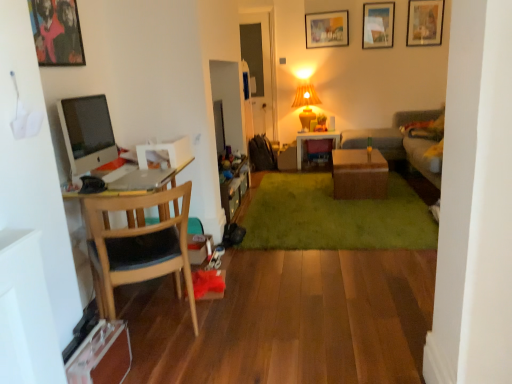
Image resolution: width=512 pixels, height=384 pixels. What do you see at coordinates (57, 32) in the screenshot? I see `metallic framed artwork at upper left, which is the fourth picture frame in right-to-left order` at bounding box center [57, 32].

Image resolution: width=512 pixels, height=384 pixels. What do you see at coordinates (334, 216) in the screenshot?
I see `green plush rug at center` at bounding box center [334, 216].

The width and height of the screenshot is (512, 384). What do you see at coordinates (359, 174) in the screenshot? I see `brown wicker table at center, which appears as the second table when viewed from the back` at bounding box center [359, 174].

How much space does wooden picture frame at upper center, positioned as the 3th picture frame in right-to-left order, occupy horizontally?

wooden picture frame at upper center, positioned as the 3th picture frame in right-to-left order, is 1.44 inches in width.

What do you see at coordinates (327, 29) in the screenshot? I see `wooden picture frame at upper center, arranged as the 1th picture frame when viewed from the back` at bounding box center [327, 29].

Find the location of a particular element. The height and width of the screenshot is (384, 512). wooden chair at left is located at coordinates (x=139, y=245).

Considering the relative positions of green plush rug at center and matte glass picture frame at upper right, the third picture frame ordered from the bottom, in the image provided, is green plush rug at center to the right of matte glass picture frame at upper right, the third picture frame ordered from the bottom, from the viewer's perspective?

Incorrect, green plush rug at center is not on the right side of matte glass picture frame at upper right, the third picture frame ordered from the bottom.

Does green plush rug at center lie behind matte glass picture frame at upper right, which is counted as the second picture frame, starting from the back?

No, it is in front of matte glass picture frame at upper right, which is counted as the second picture frame, starting from the back.

From a real-world perspective, between green plush rug at center and matte glass picture frame at upper right, which is counted as the second picture frame, starting from the back, who is vertically lower?

green plush rug at center.

Consider the image. Considering the sizes of objects green plush rug at center and matte glass picture frame at upper right, the third picture frame ordered from the bottom, in the image provided, who is bigger, green plush rug at center or matte glass picture frame at upper right, the third picture frame ordered from the bottom,?

With larger size is green plush rug at center.

Does point (232, 201) come behind point (323, 26)?

No.

From a real-world perspective, between wooden cabinet at center and wooden picture frame at upper center, the 2th picture frame when ordered from bottom to top, who is vertically lower?

wooden cabinet at center.

Is wooden cabinet at center further to the viewer compared to wooden picture frame at upper center, which is the third picture frame in top-to-bottom order?

No, wooden cabinet at center is in front of wooden picture frame at upper center, which is the third picture frame in top-to-bottom order.

Which of these two, wooden cabinet at center or wooden picture frame at upper center, which is the third picture frame in top-to-bottom order, is bigger?

wooden cabinet at center is bigger.

Would you say brown wicker table at center, arranged as the 1th table when viewed from the front, is outside wooden picture frame at upper center, positioned as the 3th picture frame in right-to-left order?

Yes, brown wicker table at center, arranged as the 1th table when viewed from the front, is not within wooden picture frame at upper center, positioned as the 3th picture frame in right-to-left order.

At what (x,y) coordinates should I click in order to perform the action: click on the 2nd table directly beneath the wooden picture frame at upper center, positioned as the 3th picture frame in right-to-left order (from a real-world perspective). Please return your answer as a coordinate pair (x, y). This screenshot has height=384, width=512. Looking at the image, I should click on (359, 174).

From the image's perspective, is brown wicker table at center, which appears as the second table when viewed from the back, positioned above or below wooden picture frame at upper center, which appears as the 2th picture frame when viewed from the left?

→ brown wicker table at center, which appears as the second table when viewed from the back, is below wooden picture frame at upper center, which appears as the 2th picture frame when viewed from the left.

Is brown wicker table at center, which appears as the second table when viewed from the back, facing away from wooden picture frame at upper center, which is the third picture frame in top-to-bottom order?

No, wooden picture frame at upper center, which is the third picture frame in top-to-bottom order, is not at the back of brown wicker table at center, which appears as the second table when viewed from the back.

Is matte glass picture frame at upper right, which is the 2th picture frame from top to bottom, oriented away from yellow fabric lampshade at upper center?

That's not correct — matte glass picture frame at upper right, which is the 2th picture frame from top to bottom, is not looking away from yellow fabric lampshade at upper center.

Can you see matte glass picture frame at upper right, the third picture frame ordered from the bottom, touching yellow fabric lampshade at upper center?

No, matte glass picture frame at upper right, the third picture frame ordered from the bottom, is not beside yellow fabric lampshade at upper center.

Which of these two, matte glass picture frame at upper right, the third picture frame ordered from the bottom, or yellow fabric lampshade at upper center, is bigger?

yellow fabric lampshade at upper center is bigger.

Locate an element on the screen. This screenshot has height=384, width=512. picture frame that is the 1st one when counting forward from the yellow fabric lampshade at upper center is located at coordinates (378, 25).

Considering the points (106, 200) and (424, 173), which point is in front, point (106, 200) or point (424, 173)?

The point (106, 200) is closer to the camera.

Is wooden chair at left situated inside gray fabric couch at right or outside?

wooden chair at left is not inside gray fabric couch at right, it's outside.

Considering the sizes of objects wooden chair at left and gray fabric couch at right in the image provided, who is bigger, wooden chair at left or gray fabric couch at right?

With larger size is gray fabric couch at right.

Is wooden chair at left in contact with gray fabric couch at right?

wooden chair at left and gray fabric couch at right are not in contact.

Is wooden cabinet at center looking in the opposite direction of brown wicker table at center, which appears as the second table when viewed from the back?

wooden cabinet at center does not have its back to brown wicker table at center, which appears as the second table when viewed from the back.

From the picture: Are wooden cabinet at center and brown wicker table at center, arranged as the 1th table when viewed from the front, making contact?

They are not placed beside each other.

Is brown wicker table at center, which appears as the second table when viewed from the back, completely or partially inside wooden cabinet at center?

No, brown wicker table at center, which appears as the second table when viewed from the back, is not inside wooden cabinet at center.

Does point (223, 184) appear closer or farther from the camera than point (362, 168)?

Point (223, 184) is closer to the camera than point (362, 168).

Based on their positions, is matte glass picture frame at upper right, which is counted as the 2th picture frame, starting from the right, located to the left or right of wooden chair at left?

From the image, it's evident that matte glass picture frame at upper right, which is counted as the 2th picture frame, starting from the right, is to the right of wooden chair at left.

What's the angular difference between matte glass picture frame at upper right, which is counted as the second picture frame, starting from the back, and wooden chair at left's facing directions?

147 degrees separate the facing orientations of matte glass picture frame at upper right, which is counted as the second picture frame, starting from the back, and wooden chair at left.

From a real-world perspective, is matte glass picture frame at upper right, the third picture frame positioned from the front, under wooden chair at left?

Actually, matte glass picture frame at upper right, the third picture frame positioned from the front, is physically above wooden chair at left in the real world.

Is matte glass picture frame at upper right, the third picture frame ordered from the bottom, taller or shorter than wooden chair at left?

In the image, matte glass picture frame at upper right, the third picture frame ordered from the bottom, appears to be shorter than wooden chair at left.

Where is `the 3rd picture frame above when counting from the green plush rug at center (from the image's perspective)`? the 3rd picture frame above when counting from the green plush rug at center (from the image's perspective) is located at coordinates (378, 25).

Find the location of `cabinetry lying in front of the wooden picture frame at upper center, arranged as the 1th picture frame when viewed from the back`. cabinetry lying in front of the wooden picture frame at upper center, arranged as the 1th picture frame when viewed from the back is located at coordinates (234, 190).

Looking at the image, which one is located further to wooden table at center, which appears as the second table when viewed from the front, gray fabric couch at right or metallic framed artwork at upper left, which is the 1th picture frame from left to right?

Based on the image, metallic framed artwork at upper left, which is the 1th picture frame from left to right, appears to be further to wooden table at center, which appears as the second table when viewed from the front.

Considering their positions, is metallic framed artwork at upper left, the fourth picture frame positioned from the top, positioned closer to matte glass picture frame at upper right, which is counted as the 2th picture frame, starting from the right, than green plush rug at center?

The object closer to matte glass picture frame at upper right, which is counted as the 2th picture frame, starting from the right, is green plush rug at center.

Considering their positions, is gray fabric couch at right positioned closer to wooden picture frame at upper center, positioned as the 3th picture frame in right-to-left order, than wooden cabinet at center?

Based on the image, gray fabric couch at right appears to be nearer to wooden picture frame at upper center, positioned as the 3th picture frame in right-to-left order.

Based on their spatial positions, is gray fabric couch at right or yellow fabric lampshade at upper center further from wooden cabinet at center?

gray fabric couch at right is further to wooden cabinet at center.

Estimate the real-world distances between objects in this image. Which object is further from metallic framed artwork at upper left, the first picture frame in the front-to-back sequence, yellow fabric lampshade at upper center or wooden chair at left?

Based on the image, yellow fabric lampshade at upper center appears to be further to metallic framed artwork at upper left, the first picture frame in the front-to-back sequence.

Looking at this image, based on their spatial positions, is wooden picture frame at upper center, the fourth picture frame viewed from the front, or green plush rug at center closer to gray fabric couch at right?

The object closer to gray fabric couch at right is wooden picture frame at upper center, the fourth picture frame viewed from the front.

Considering their positions, is yellow fabric lampshade at upper center positioned further to silver metallic laptop at left than wooden picture frame at upper right, acting as the 3th picture frame starting from the back?

Among the two, wooden picture frame at upper right, acting as the 3th picture frame starting from the back, is located further to silver metallic laptop at left.

Based on their spatial positions, is silver metallic laptop at left or wooden picture frame at upper center, the fourth picture frame viewed from the front, closer to wooden chair at left?

silver metallic laptop at left lies closer to wooden chair at left than the other object.

Find the location of `plain between wooden cabinet at center and brown wicker table at center, which appears as the second table when viewed from the back, from left to right`. plain between wooden cabinet at center and brown wicker table at center, which appears as the second table when viewed from the back, from left to right is located at coordinates (334, 216).

Find the location of `couch positioned between wooden chair at left and matte glass picture frame at upper right, which is counted as the second picture frame, starting from the back, from near to far`. couch positioned between wooden chair at left and matte glass picture frame at upper right, which is counted as the second picture frame, starting from the back, from near to far is located at coordinates (400, 143).

Where is `cabinetry located between silver metallic laptop at left and green plush rug at center in the left-right direction`? This screenshot has height=384, width=512. cabinetry located between silver metallic laptop at left and green plush rug at center in the left-right direction is located at coordinates (234, 190).

You are a GUI agent. You are given a task and a screenshot of the screen. Output one action in this format:
    pyautogui.click(x=<x>, y=<y>)
    Task: Click on the plain between metallic framed artwork at upper left, which is the fourth picture frame in right-to-left order, and matte glass picture frame at upper right, which is counted as the 2th picture frame, starting from the right, along the z-axis
    
    Given the screenshot: What is the action you would take?
    pyautogui.click(x=334, y=216)